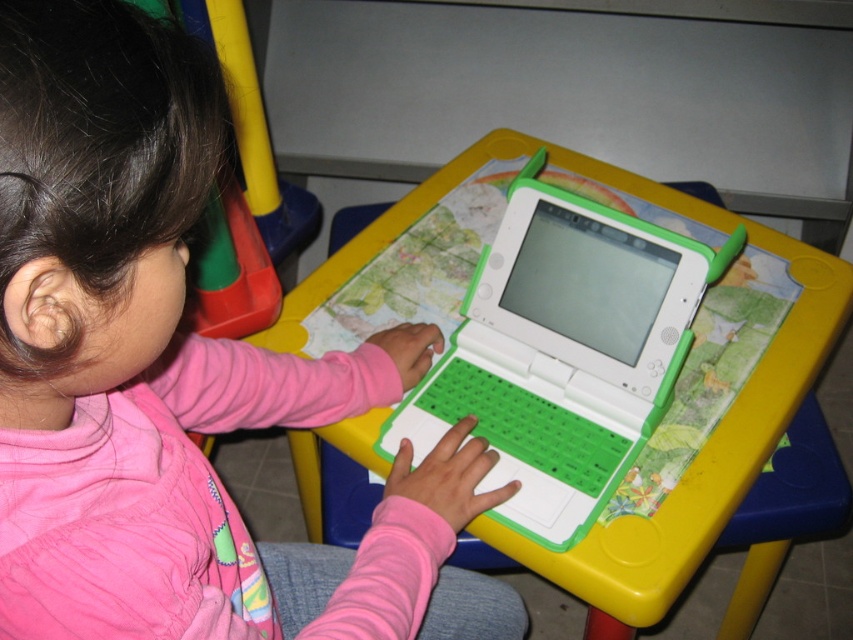
Can you confirm if pink fleece shirt at center is positioned below green plastic laptop at center?

Indeed, pink fleece shirt at center is positioned under green plastic laptop at center.

Describe the element at coordinates (177, 378) in the screenshot. I see `pink fleece shirt at center` at that location.

Where is `pink fleece shirt at center`? pink fleece shirt at center is located at coordinates (177, 378).

At what (x,y) coordinates should I click in order to perform the action: click on pink fleece shirt at center. Please return your answer as a coordinate pair (x, y). The image size is (853, 640). Looking at the image, I should click on (177, 378).

Is pink fleece shirt at center closer to the viewer compared to yellow plastic table at center?

That is True.

In the scene shown: Who is more distant from viewer, (224, 625) or (410, 209)?

The point (410, 209) is behind.

Where is `pink fleece shirt at center`? The width and height of the screenshot is (853, 640). pink fleece shirt at center is located at coordinates (177, 378).

Looking at this image, is green plastic laptop at center closer to the viewer compared to yellow plastic table at center?

No, green plastic laptop at center is further to the viewer.

The image size is (853, 640). Describe the element at coordinates (563, 353) in the screenshot. I see `green plastic laptop at center` at that location.

Is point (724, 269) positioned after point (582, 563)?

Yes, point (724, 269) is behind point (582, 563).

Identify the location of green plastic laptop at center. This screenshot has width=853, height=640. (563, 353).